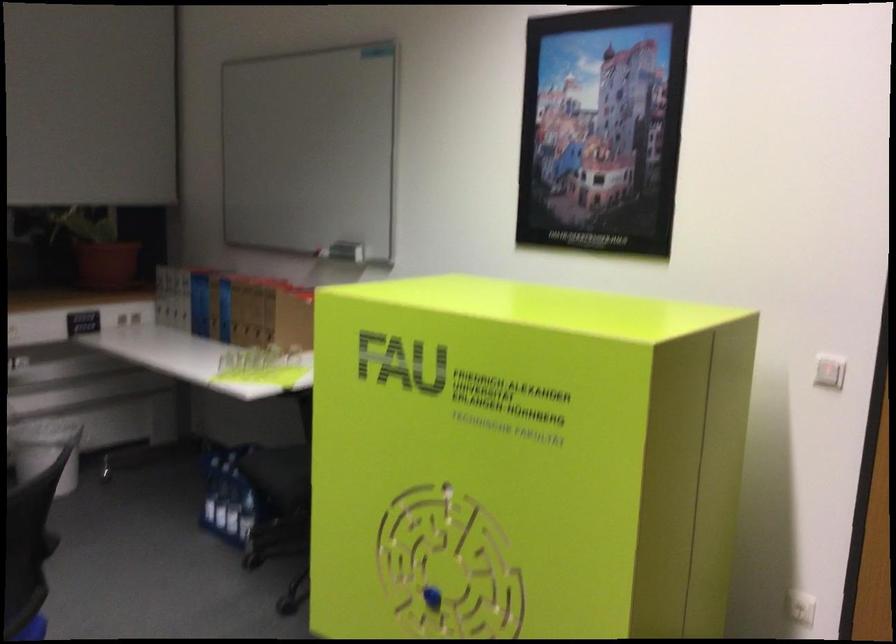
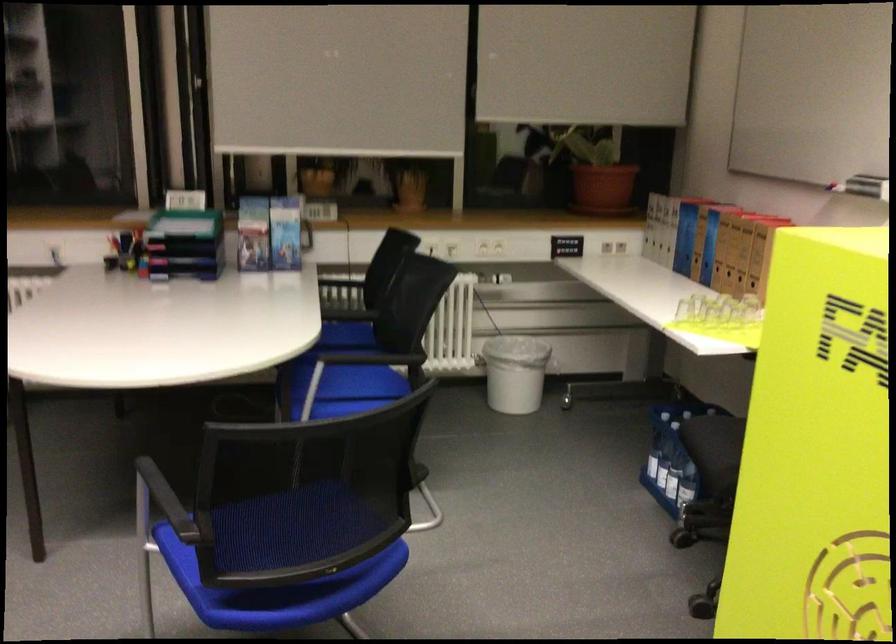
Where in the second image is the point corresponding to point 222,506 from the first image?

(661, 465)